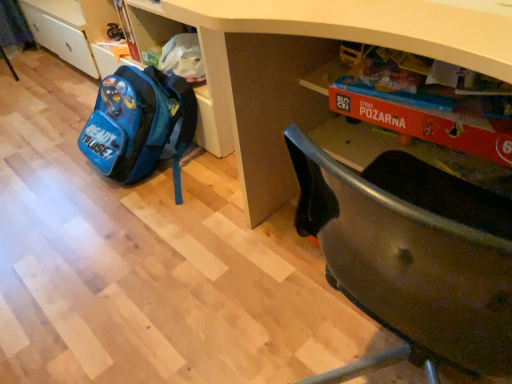
The image size is (512, 384). What are the coordinates of `free spot in front of blue fabric backpack at lower left` in the screenshot? It's located at (138, 238).